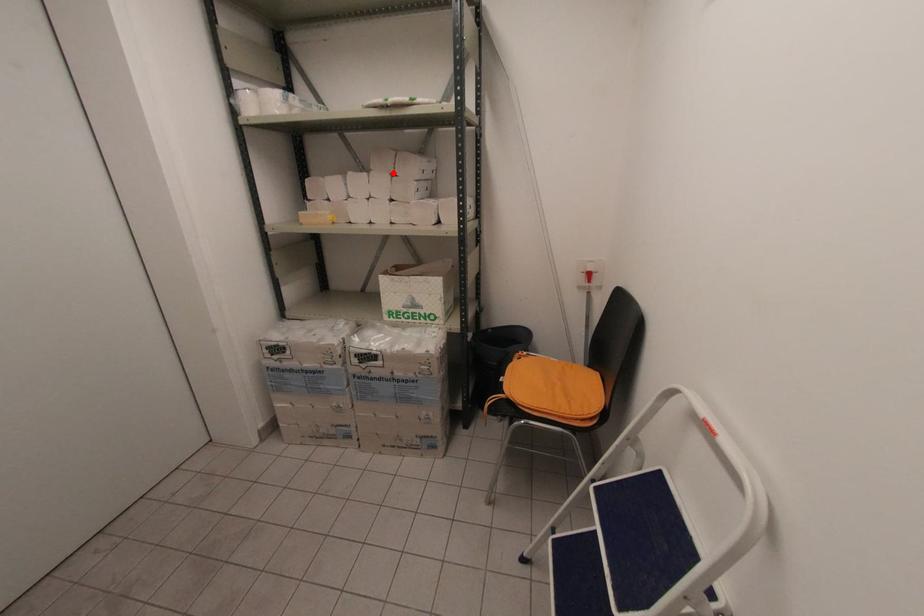
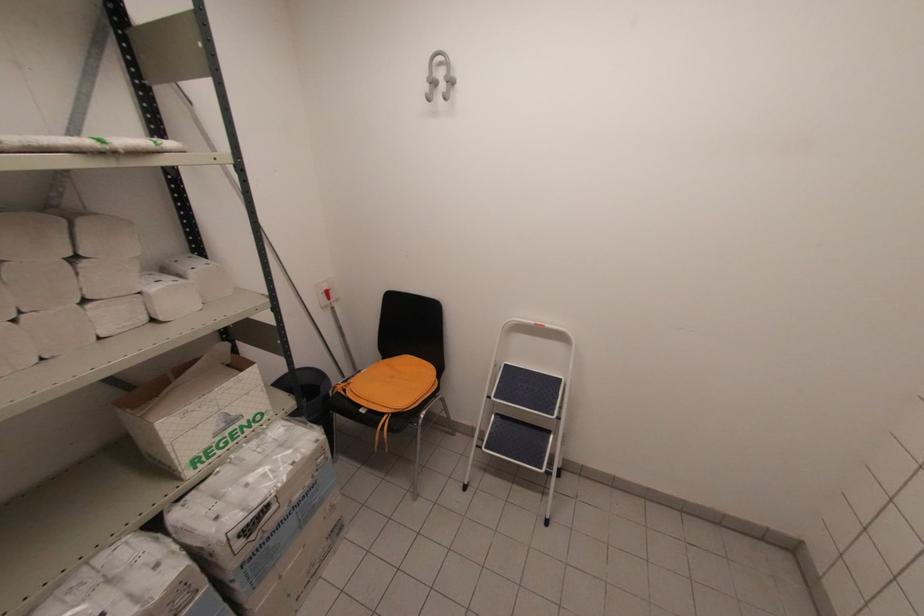
The point at the highlighted location is marked in the first image. Where is the corresponding point in the second image?

(71, 254)